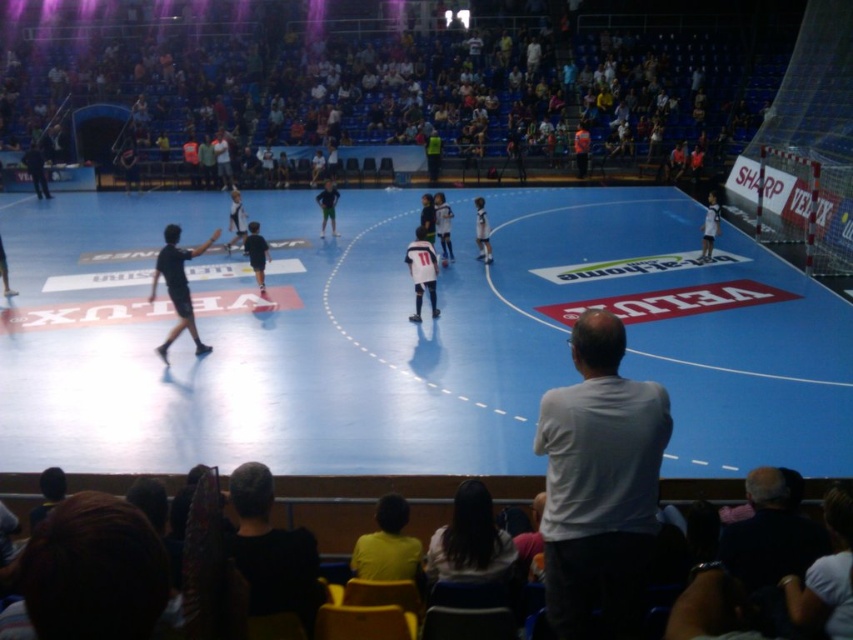
Question: Which is farther from the black matte shirt at left?

Choices:
 (A) yellow shirt at lower center
 (B) white matte shirt at center

Answer: (B)

Question: Which point appears farthest from the camera in this image?

Choices:
 (A) (18, 227)
 (B) (418, 284)
 (C) (488, 544)
 (D) (375, 541)

Answer: (A)

Question: Is white matte shirt at center further to camera compared to black matte shirt at left?

Choices:
 (A) yes
 (B) no

Answer: (B)

Question: Is white matte shirt at center bigger than black matte shirt at left?

Choices:
 (A) no
 (B) yes

Answer: (A)

Question: Which object is the closest to the dark brown hair at lower center?

Choices:
 (A) white jersey at center
 (B) yellow shirt at lower center
 (C) black matte shirt at left
 (D) blue rubber basketball court at center

Answer: (B)

Question: Does yellow shirt at lower center appear under black matte shirt at left?

Choices:
 (A) no
 (B) yes

Answer: (B)